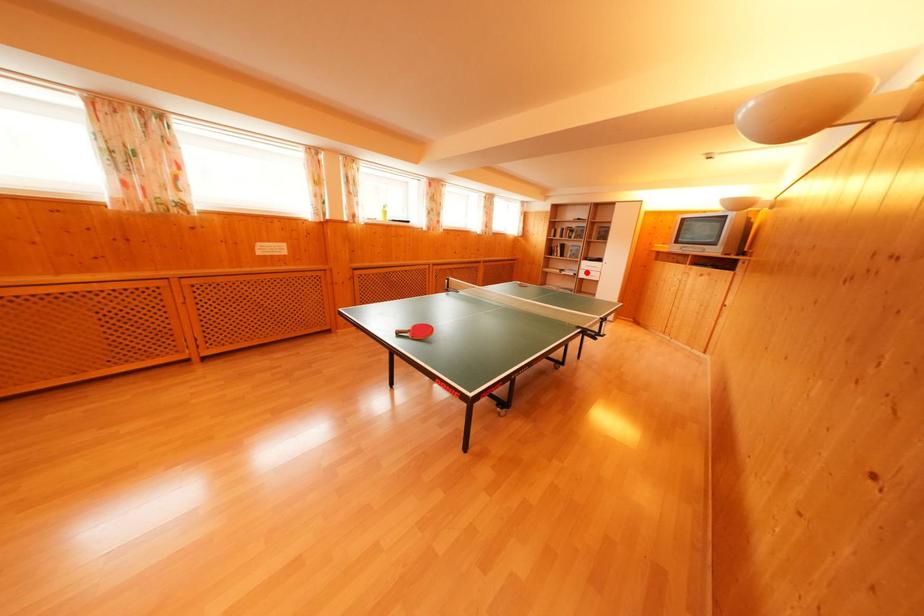
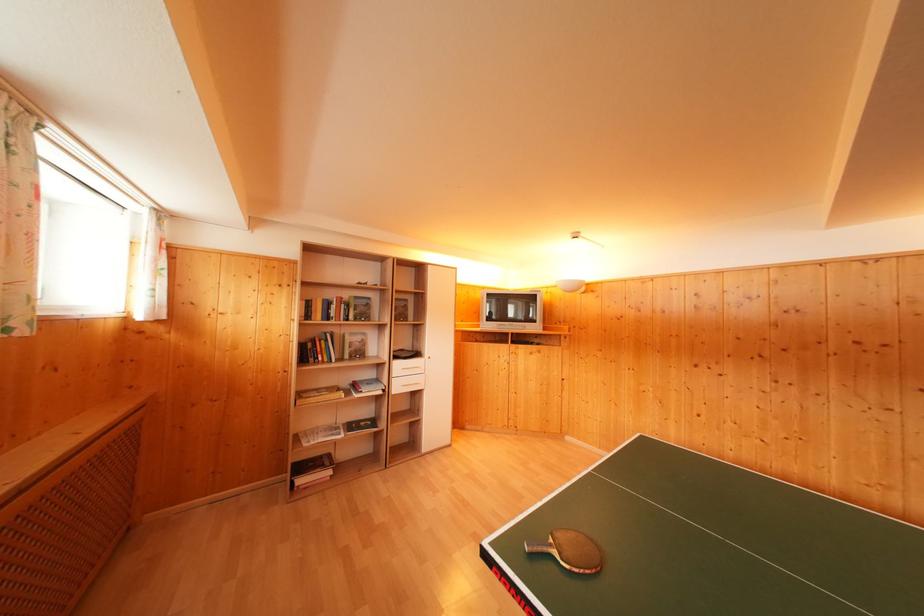
In the second image, find the point that corresponds to the highlighted location in the first image.

(398, 379)